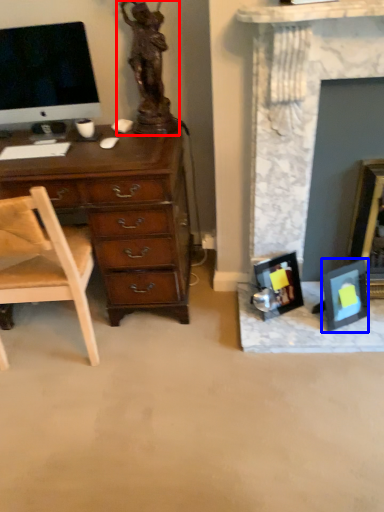
Question: Which object is further to the camera taking this photo, sculpture (highlighted by a red box) or picture frame (highlighted by a blue box)?

Choices:
 (A) sculpture
 (B) picture frame

Answer: (B)